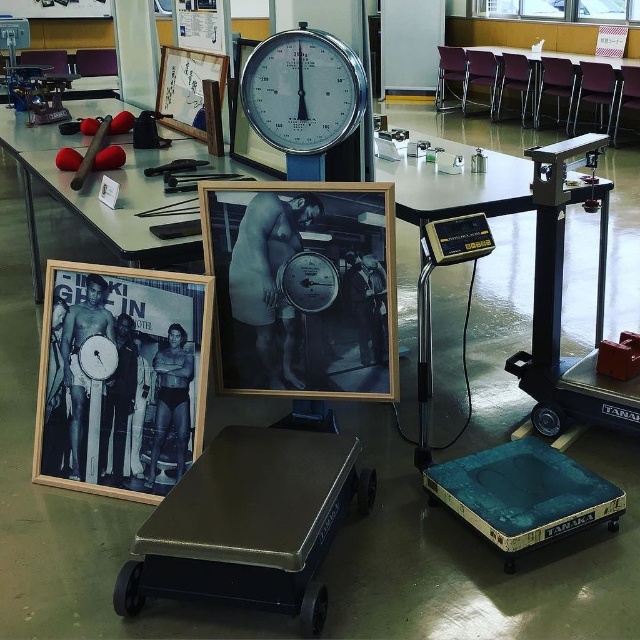
You are standing in the classroom and need to place a new poster exactly where the black wood picture frame at center is currently located. According to the coordinates provided, where should you position the poster?

The black wood picture frame at center is located at point [301,285], so you should position the poster at those coordinates.

You are a student in the classroom and need to reach both the metallic black cart at center and the metallic gray scale at right. Which one do you need to walk towards first?

You should walk towards the metallic black cart at center first because it is closer to you than the metallic gray scale at right.

You are a student in the classroom and want to hang both the matte wooden picture frame at upper center and the rubber mat at upper left on a wall. Which object requires a wider hook to be securely mounted?

The matte wooden picture frame at upper center requires a wider hook because its width is greater than the rubber mat at upper left.